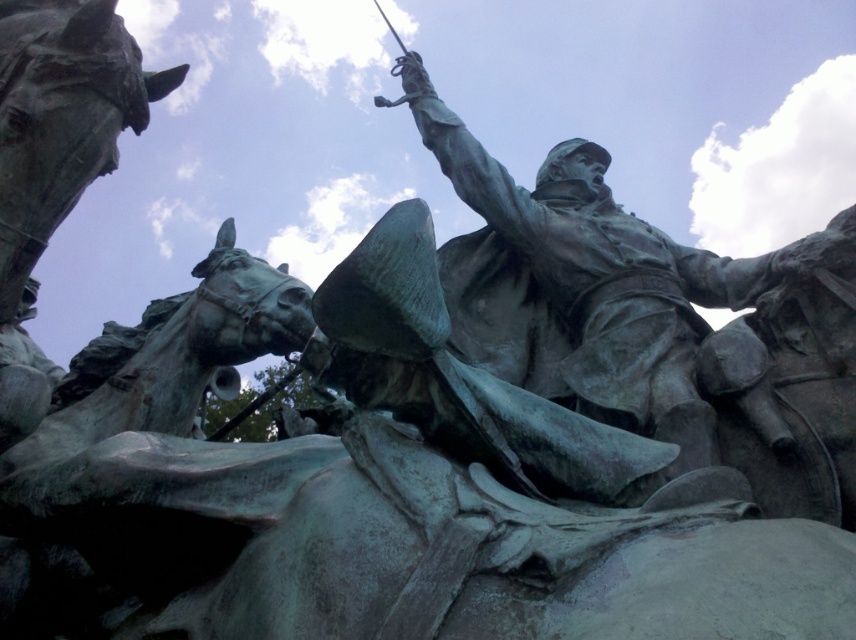
Question: Which of the following is the closest to the observer?

Choices:
 (A) (652, 241)
 (B) (0, 285)

Answer: (B)

Question: Can you confirm if green patina statue at center is wider than green patina horse at upper left?

Choices:
 (A) no
 (B) yes

Answer: (B)

Question: Which point is farther to the camera?

Choices:
 (A) green patina horse at upper left
 (B) green patina statue at center

Answer: (A)

Question: Does green patina statue at center appear on the left side of green patina horse at upper left?

Choices:
 (A) no
 (B) yes

Answer: (A)

Question: Among these objects, which one is nearest to the camera?

Choices:
 (A) green patina horse at upper left
 (B) green patina statue at center

Answer: (B)

Question: In this image, where is green patina statue at center located relative to green patina horse at upper left?

Choices:
 (A) above
 (B) below

Answer: (B)